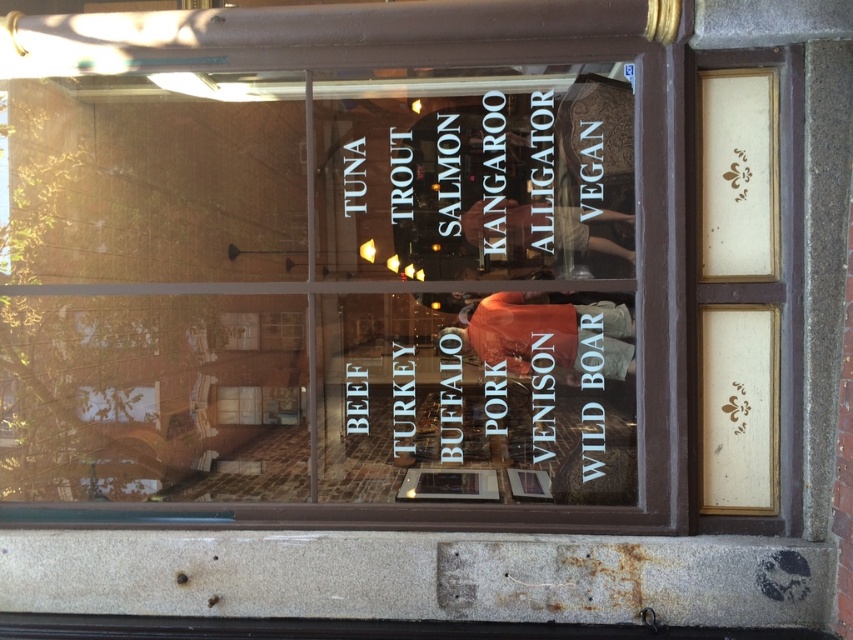
Question: Which point appears closest to the camera in this image?

Choices:
 (A) (378, 225)
 (B) (550, 372)

Answer: (B)

Question: Does transparent glass menu at center appear on the right side of black paper at upper center?

Choices:
 (A) no
 (B) yes

Answer: (A)

Question: Considering the relative positions of white paper text at center and black paper at upper center in the image provided, where is white paper text at center located with respect to black paper at upper center?

Choices:
 (A) left
 (B) right

Answer: (B)

Question: Does white paper text at center appear on the right side of black paper at upper center?

Choices:
 (A) yes
 (B) no

Answer: (A)

Question: Which object is the closest to the black paper at upper center?

Choices:
 (A) white paper text at center
 (B) transparent glass menu at center

Answer: (B)

Question: Which point is farther from the camera taking this photo?

Choices:
 (A) (355, 412)
 (B) (456, 236)

Answer: (A)